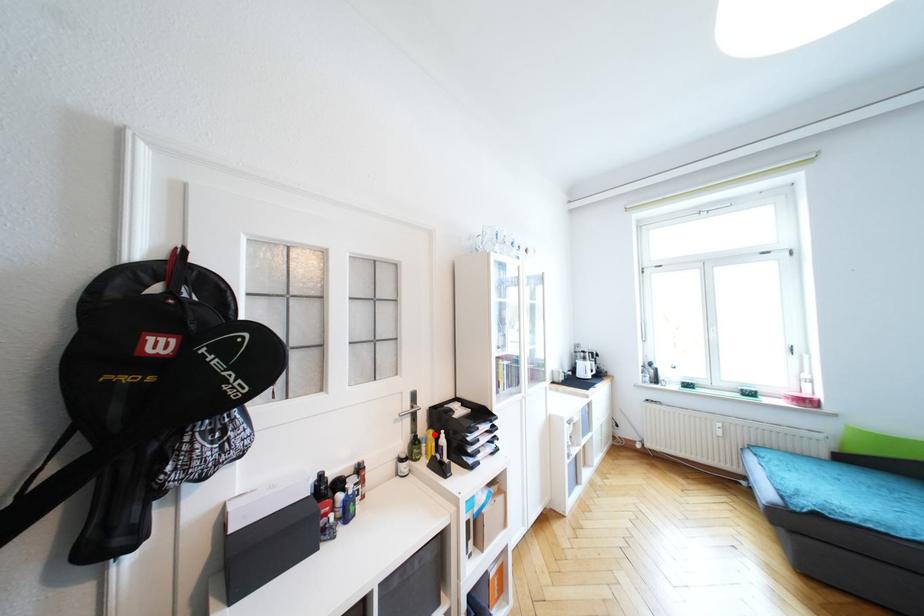
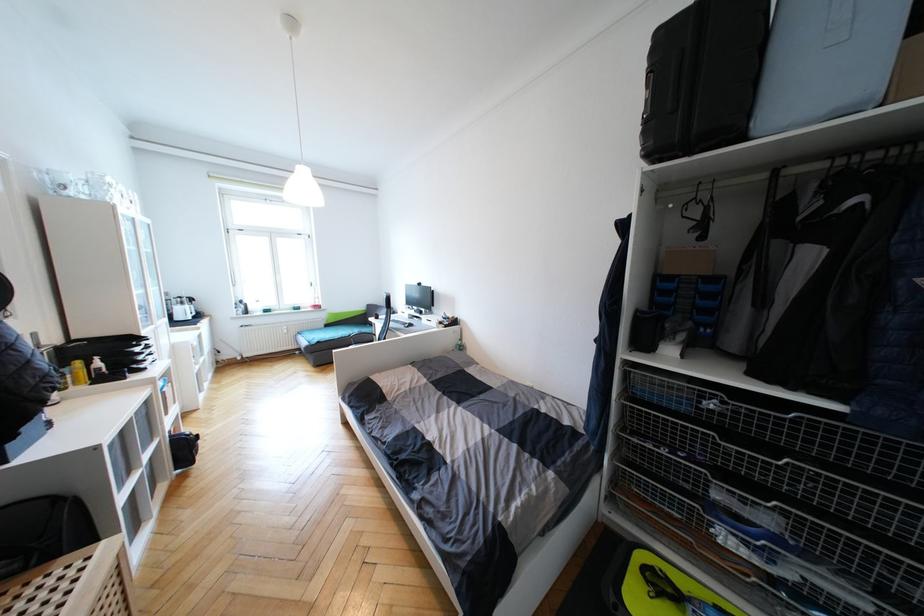
The point at the highlighted location is marked in the first image. Where is the corresponding point in the second image?

(81, 363)